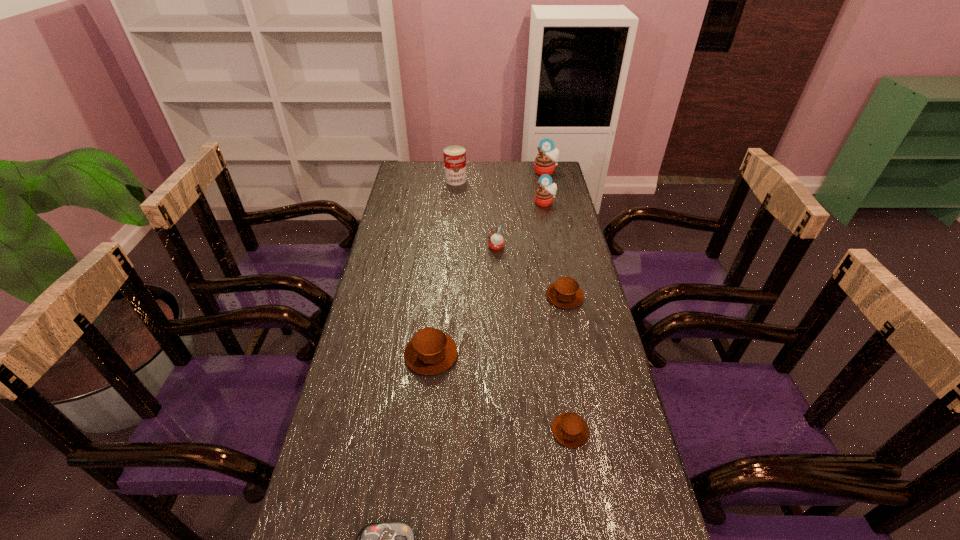
Locate an element on the screen. pink muffin that is the second closest to the tallest muffin is located at coordinates (496, 241).

This screenshot has height=540, width=960. What are the coordinates of `brown muffin identified as the second closest to the leftmost pink muffin` in the screenshot? It's located at (430, 351).

Select which brown muffin is the second closest to the nearest muffin. Please provide its 2D coordinates. Your answer should be formatted as a tuple, i.e. [(x, y)], where the tuple contains the x and y coordinates of a point satisfying the conditions above.

[(565, 293)]

At what (x,y) coordinates should I click in order to perform the action: click on free region that satisfies the following two spatial constraints: 1. on the front-facing side of the nearest pink muffin; 2. on the back side of the farthest brown muffin. Please return your answer as a coordinate pair (x, y). This screenshot has width=960, height=540. Looking at the image, I should click on (498, 296).

At what (x,y) coordinates should I click in order to perform the action: click on vacant space that satisfies the following two spatial constraints: 1. on the front label of the can; 2. on the right side of the farthest brown muffin. Please return your answer as a coordinate pair (x, y). The height and width of the screenshot is (540, 960). Looking at the image, I should click on (446, 296).

This screenshot has width=960, height=540. What are the coordinates of `free space that satisfies the following two spatial constraints: 1. on the front-facing side of the second smallest brown muffin; 2. on the right side of the second muffin from left to right` in the screenshot? It's located at (498, 296).

Locate an element on the screen. vacant region that satisfies the following two spatial constraints: 1. on the front-facing side of the tallest muffin; 2. on the front-facing side of the fifth object from right to left is located at coordinates (563, 247).

This screenshot has height=540, width=960. What are the coordinates of `vacant space that satisfies the following two spatial constraints: 1. on the front-facing side of the leftmost pink muffin; 2. on the back side of the second shortest muffin` in the screenshot? It's located at (498, 296).

Find the location of a particular element. This screenshot has width=960, height=540. vacant space that satisfies the following two spatial constraints: 1. on the front label of the nearest muffin; 2. on the left side of the can is located at coordinates pyautogui.click(x=436, y=431).

The image size is (960, 540). What are the coordinates of `vacant space that satisfies the following two spatial constraints: 1. on the front-facing side of the second smallest pink muffin; 2. on the right side of the farthest brown muffin` in the screenshot? It's located at pos(564,296).